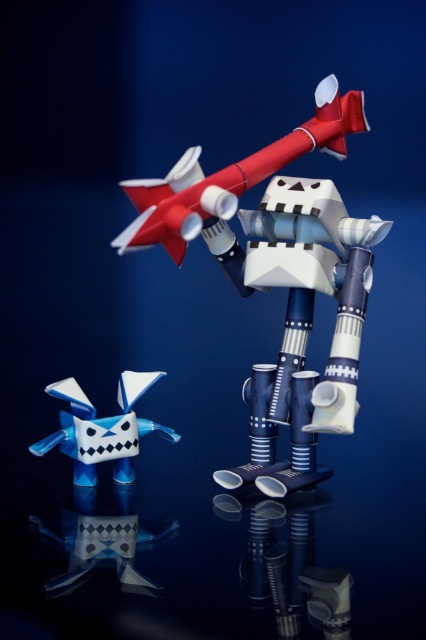
Question: In this image, where is matte plastic rocket at center located relative to translucent blue plastic toy at lower left?

Choices:
 (A) right
 (B) left

Answer: (A)

Question: Can you confirm if matte plastic rocket at center is positioned below translucent blue plastic toy at lower left?

Choices:
 (A) yes
 (B) no

Answer: (B)

Question: Which point appears closest to the camera in this image?

Choices:
 (A) coord(219,188)
 (B) coord(66,417)

Answer: (A)

Question: Which point is closer to the camera?

Choices:
 (A) translucent blue plastic toy at lower left
 (B) matte plastic rocket at center

Answer: (B)

Question: Which point is closer to the camera taking this photo?

Choices:
 (A) (331, 118)
 (B) (339, 396)

Answer: (B)

Question: Is matte plastic robot at center further to camera compared to matte plastic rocket at center?

Choices:
 (A) yes
 (B) no

Answer: (A)